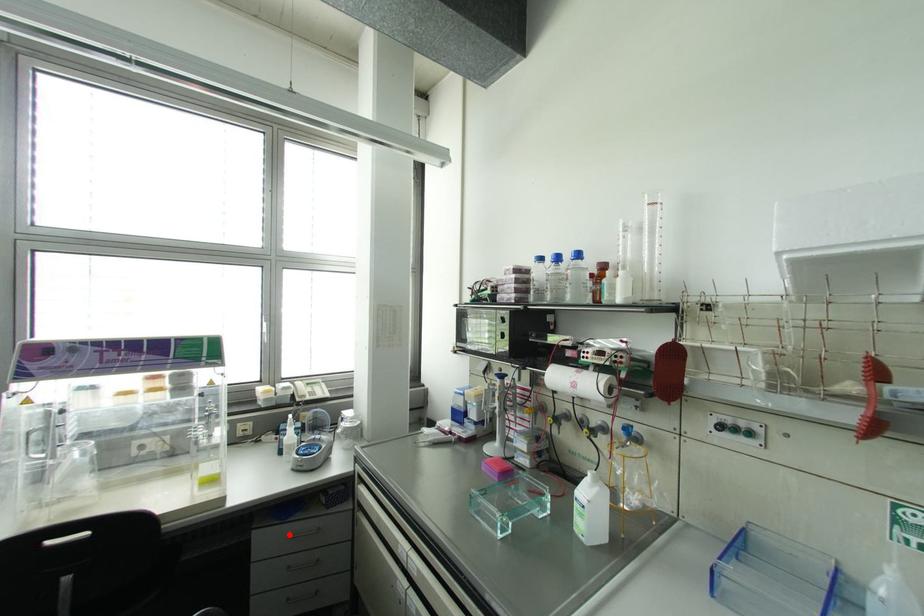
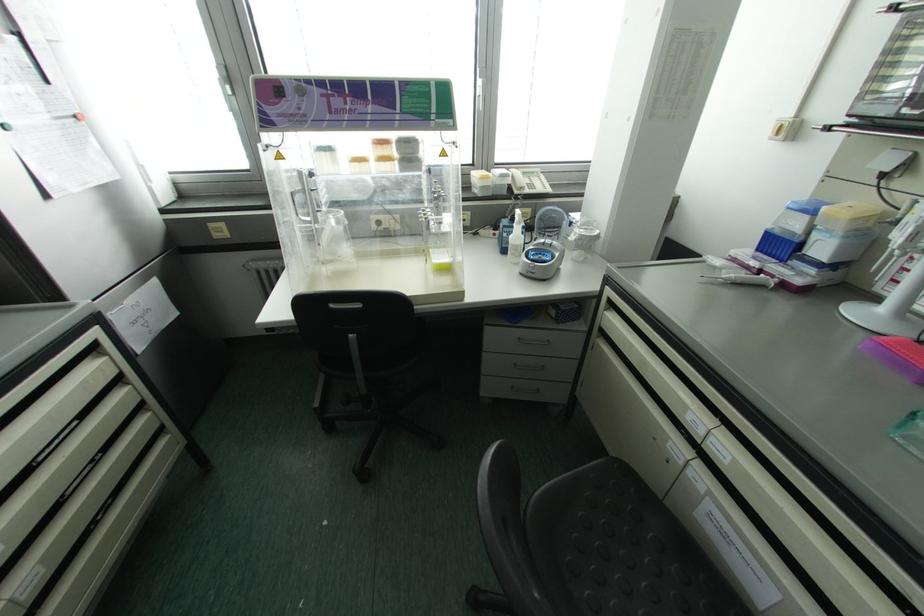
Locate, in the second image, the point that corresponds to the highlighted location in the first image.

(518, 339)